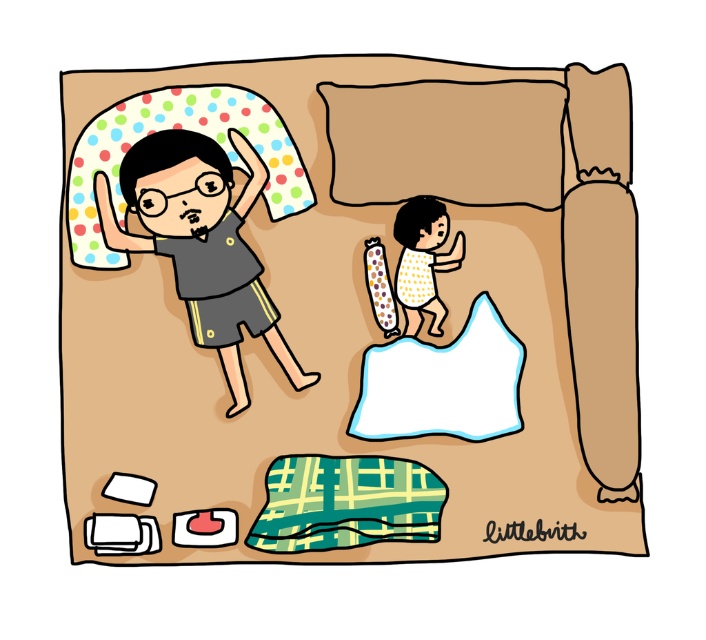
Question: Which point appears farthest from the camera in this image?

Choices:
 (A) (481, 93)
 (B) (442, 545)
 (C) (353, 419)

Answer: (C)

Question: Does polka dot pillow at upper left have a greater width compared to brown fabric pillow at upper center?

Choices:
 (A) yes
 (B) no

Answer: (A)

Question: Which of the following is the farthest from the observer?

Choices:
 (A) yellow dotted shirt at upper center
 (B) white fabric pillow at upper center
 (C) brown fabric pillow at upper center

Answer: (A)

Question: Where is brown fabric pillow at upper center located in relation to matte black shirt at upper left in the image?

Choices:
 (A) left
 (B) right

Answer: (B)

Question: Which object is closer to the camera taking this photo?

Choices:
 (A) polka dot pillow at upper left
 (B) brown fabric pillow at upper center

Answer: (A)

Question: Does matte black shirt at upper left have a smaller size compared to yellow dotted shirt at upper center?

Choices:
 (A) no
 (B) yes

Answer: (A)